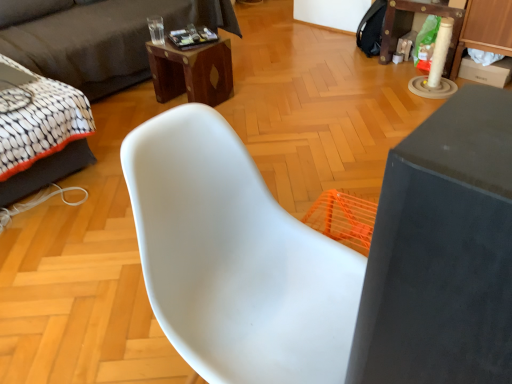
The image size is (512, 384). Find the location of `vacant space that is to the left of wooden desk at upper center`. vacant space that is to the left of wooden desk at upper center is located at coordinates (138, 114).